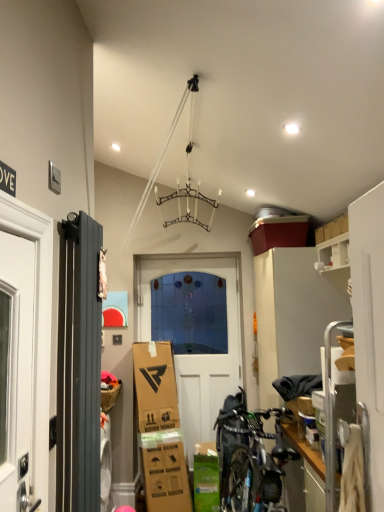
You are a GUI agent. You are given a task and a screenshot of the screen. Output one action in this format:
    pyautogui.click(x=<x>, y=<y>)
    Task: Click on the white matte door at center
    The image size is (384, 512).
    Given the screenshot: What is the action you would take?
    pyautogui.click(x=195, y=351)

What do you see at coordinates (195, 351) in the screenshot? The image size is (384, 512). I see `white matte door at center` at bounding box center [195, 351].

Measure the distance between point (213,407) and camera.

Point (213,407) is 3.88 meters away from camera.

Identify the location of white matte door at center. (195, 351).